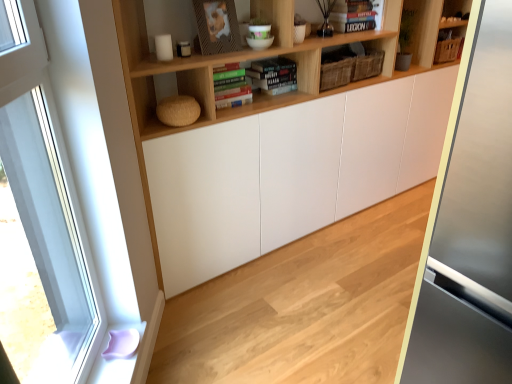
Question: Is hardcover book at upper center, arranged as the 2th book when viewed from the left, smaller than clear glass window at left?

Choices:
 (A) no
 (B) yes

Answer: (B)

Question: Is hardcover book at upper center, the second book from the bottom, in front of clear glass window at left?

Choices:
 (A) no
 (B) yes

Answer: (A)

Question: Is hardcover book at upper center, placed as the first book when sorted from right to left, facing away from clear glass window at left?

Choices:
 (A) no
 (B) yes

Answer: (A)

Question: Can you confirm if hardcover book at upper center, placed as the first book when sorted from right to left, is wider than clear glass window at left?

Choices:
 (A) no
 (B) yes

Answer: (B)

Question: Is hardcover book at upper center, placed as the first book when sorted from right to left, at the right side of clear glass window at left?

Choices:
 (A) yes
 (B) no

Answer: (A)

Question: Does point (x=369, y=31) appear closer or farther from the camera than point (x=391, y=263)?

Choices:
 (A) farther
 (B) closer

Answer: (A)

Question: Considering the positions of wooden shelf at upper center and natural wood floor at center in the image, is wooden shelf at upper center wider or thinner than natural wood floor at center?

Choices:
 (A) wide
 (B) thin

Answer: (B)

Question: From the image's perspective, is wooden shelf at upper center located above or below natural wood floor at center?

Choices:
 (A) above
 (B) below

Answer: (A)

Question: Is wooden shelf at upper center to the left or to the right of natural wood floor at center in the image?

Choices:
 (A) left
 (B) right

Answer: (A)

Question: From a real-world perspective, is hardcover book at center, positioned as the 1th book in front-to-back order, above or below wooden shelf at upper center?

Choices:
 (A) below
 (B) above

Answer: (A)

Question: Considering their positions, is hardcover book at center, which ranks as the first book in bottom-to-top order, located in front of or behind wooden shelf at upper center?

Choices:
 (A) front
 (B) behind

Answer: (B)

Question: From the image's perspective, relative to wooden shelf at upper center, is hardcover book at center, which appears as the 1th book when viewed from the left, above or below?

Choices:
 (A) above
 (B) below

Answer: (B)

Question: Is hardcover book at center, positioned as the 2th book in top-to-bottom order, taller or shorter than wooden shelf at upper center?

Choices:
 (A) short
 (B) tall

Answer: (A)

Question: Considering the positions of wooden shelf at upper center and hardcover book at upper center, arranged as the 2th book when viewed from the left, in the image, is wooden shelf at upper center wider or thinner than hardcover book at upper center, arranged as the 2th book when viewed from the left,?

Choices:
 (A) thin
 (B) wide

Answer: (B)

Question: In terms of height, does wooden shelf at upper center look taller or shorter compared to hardcover book at upper center, the second book from the bottom?

Choices:
 (A) tall
 (B) short

Answer: (A)